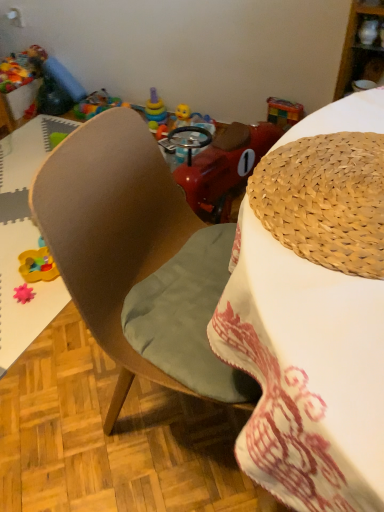
I want to click on vacant space that is to the left of pink rubber star at lower left, which appears as the third toy when viewed from the back, so click(8, 295).